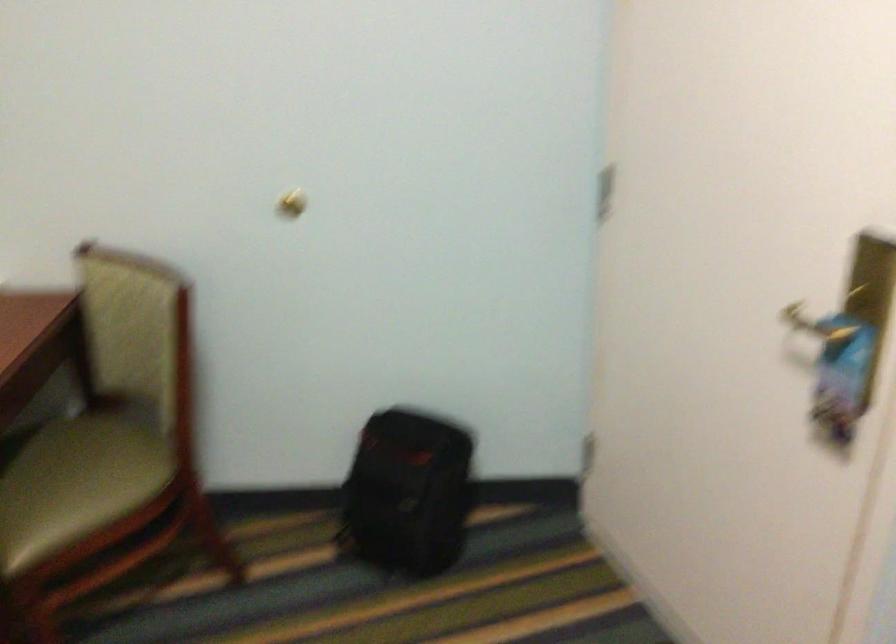
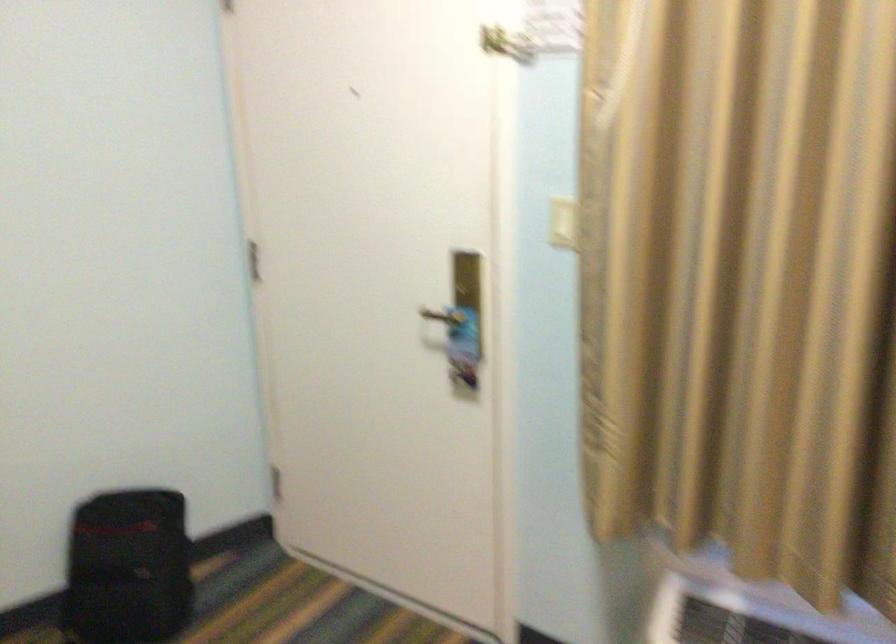
Locate, in the second image, the point that corresponds to [390,503] in the first image.

(128, 567)